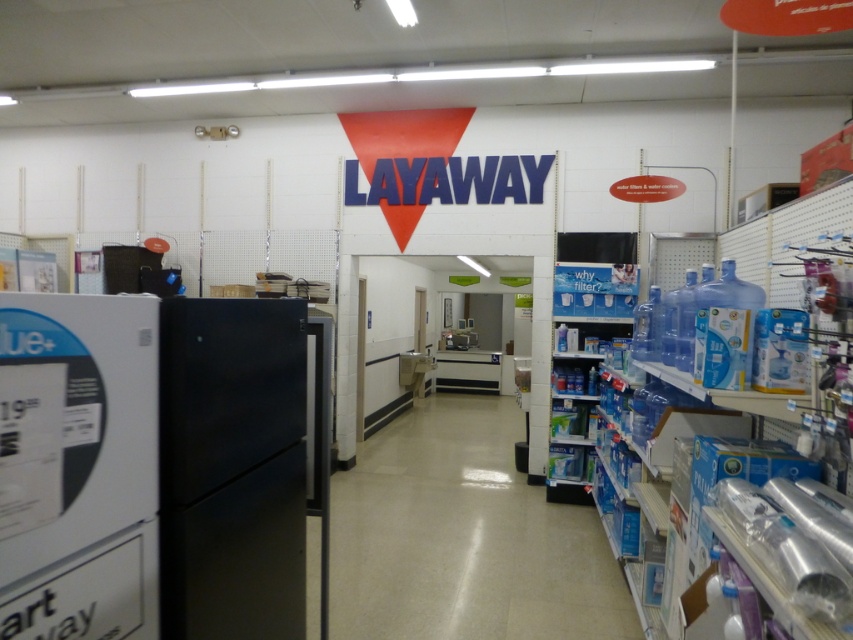
You are a customer in the store and want to compare the height of the clear plastic bottles at center and the clear plastic bottle at right. Which one is taller?

The clear plastic bottle at right is taller than the clear plastic bottles at center.

What are the coordinates of the clear plastic bottles at center?

The clear plastic bottles at center are located at coordinates point (463, 538).